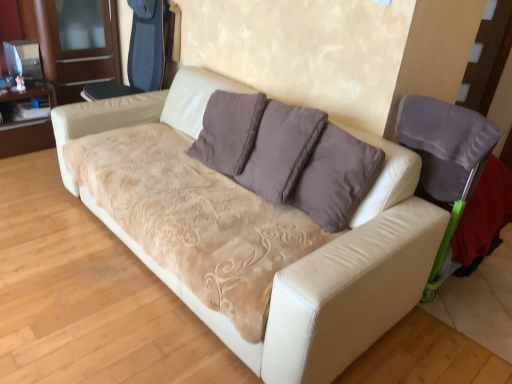
Question: Considering the positions of velvet purple armchair at right, the second armchair positioned from the left, and brushed wood dresser at left in the image, is velvet purple armchair at right, the second armchair positioned from the left, bigger or smaller than brushed wood dresser at left?

Choices:
 (A) big
 (B) small

Answer: (B)

Question: From the image's perspective, is velvet purple armchair at right, which is the second armchair in back-to-front order, above or below brushed wood dresser at left?

Choices:
 (A) above
 (B) below

Answer: (B)

Question: Estimate the real-world distances between objects in this image. Which object is closer to the brushed wood dresser at left?

Choices:
 (A) white leather couch at center
 (B) dark blue fabric armchair at upper left, marked as the first armchair in a left-to-right arrangement
 (C) velvet purple armchair at right, placed as the 1th armchair when sorted from right to left

Answer: (B)

Question: Estimate the real-world distances between objects in this image. Which object is closer to the velvet purple armchair at right, which is the 1th armchair in bottom-to-top order?

Choices:
 (A) dark blue fabric armchair at upper left, which is the second armchair in right-to-left order
 (B) brushed wood dresser at left
 (C) white leather couch at center

Answer: (C)